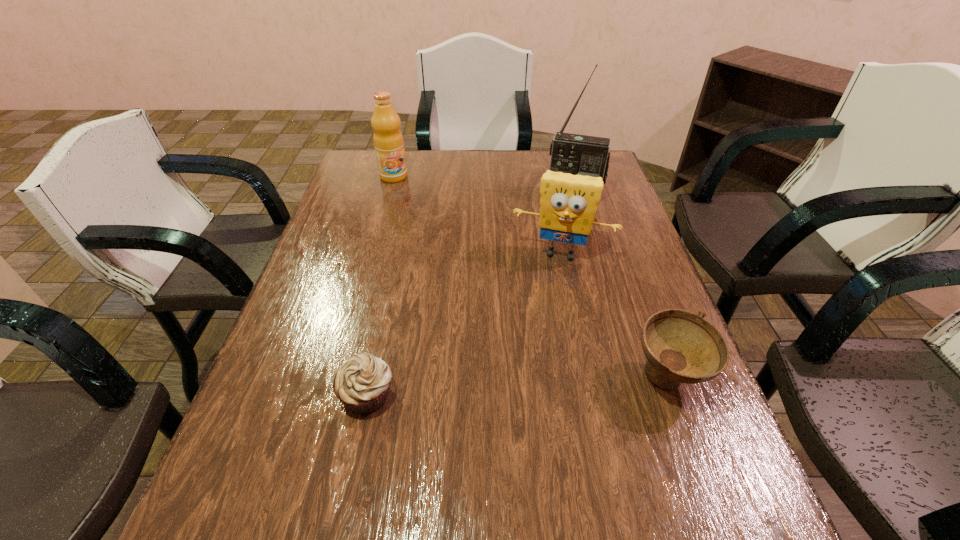
This screenshot has height=540, width=960. Identify the location of blank region between the third nearest object and the soup bowl. (614, 315).

Image resolution: width=960 pixels, height=540 pixels. What are the coordinates of `empty location between the fourth shortest object and the fourth nearest object` in the screenshot? It's located at (484, 186).

You are a GUI agent. You are given a task and a screenshot of the screen. Output one action in this format:
    pyautogui.click(x=<x>, y=<y>)
    Task: Click on the free space between the shortest object and the fourth tallest object
    
    Given the screenshot: What is the action you would take?
    pyautogui.click(x=517, y=387)

The width and height of the screenshot is (960, 540). I want to click on vacant region between the shortest object and the fourth tallest object, so click(517, 387).

At what (x,y) coordinates should I click in order to perform the action: click on free space between the third shortest object and the soup bowl. Please return your answer as a coordinate pair (x, y). This screenshot has height=540, width=960. Looking at the image, I should click on (614, 315).

Identify the location of vacant space in between the farthest object and the third tallest object. (477, 214).

Image resolution: width=960 pixels, height=540 pixels. Find the location of `free spot between the soup bowl and the second farthest object`. free spot between the soup bowl and the second farthest object is located at coordinates (621, 287).

Select which object appears as the closest to the third farthest object. Please provide its 2D coordinates. Your answer should be formatted as a tuple, i.e. [(x, y)], where the tuple contains the x and y coordinates of a point satisfying the conditions above.

[(576, 154)]

Locate which object is the closest to the fourth shortest object. Please provide its 2D coordinates. Your answer should be formatted as a tuple, i.e. [(x, y)], where the tuple contains the x and y coordinates of a point satisfying the conditions above.

[(568, 202)]

Locate an element on the screen. This screenshot has width=960, height=540. vacant space that satisfies the following two spatial constraints: 1. on the front side of the farthest object; 2. on the right side of the muffin is located at coordinates (333, 394).